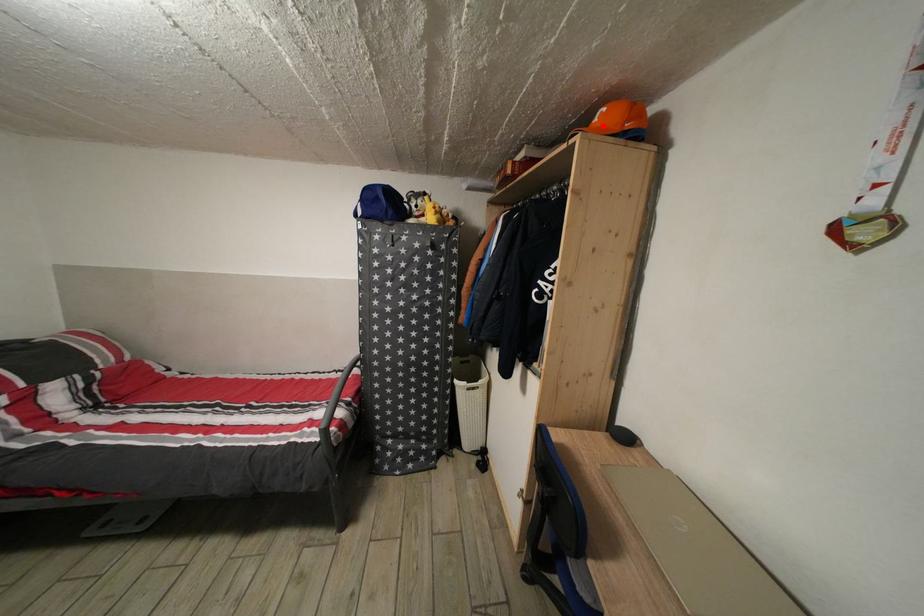
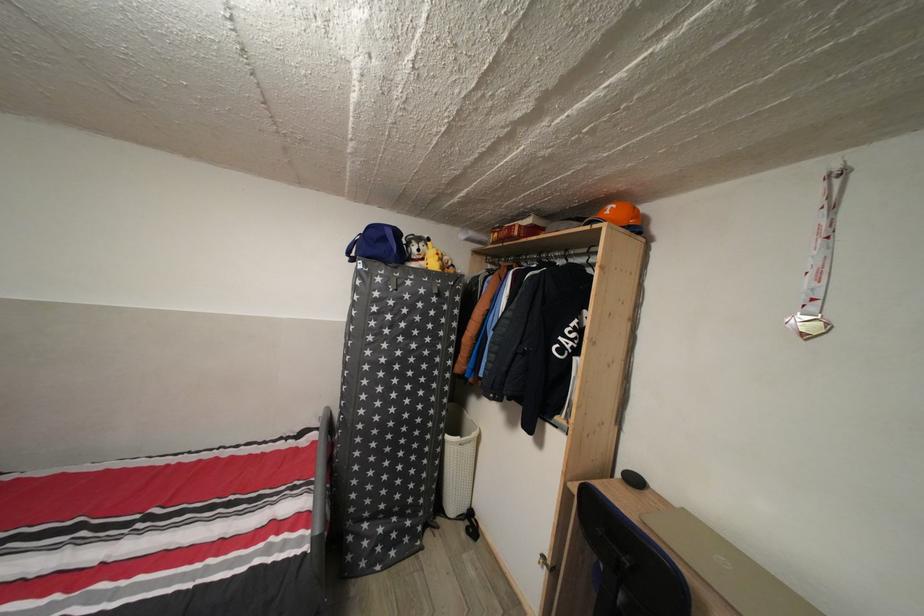
Find the pixel in the second image that matches the highlighted location in the first image.

(614, 219)